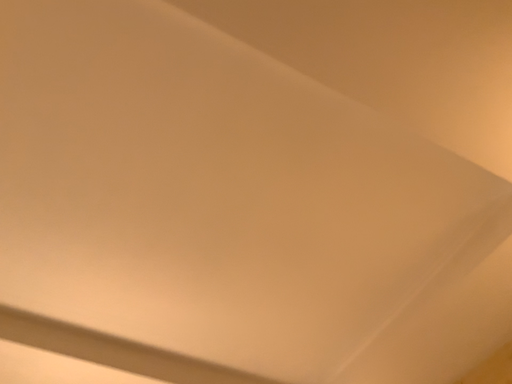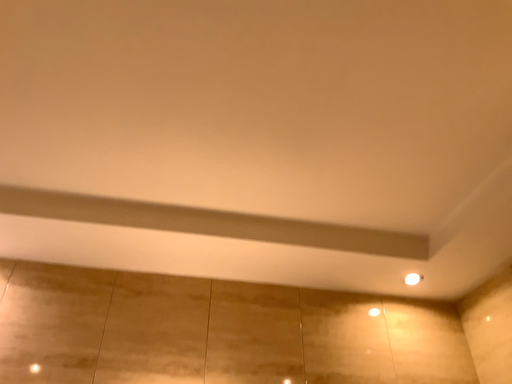
Question: Which way did the camera rotate in the video?

Choices:
 (A) rotated right
 (B) rotated left

Answer: (B)